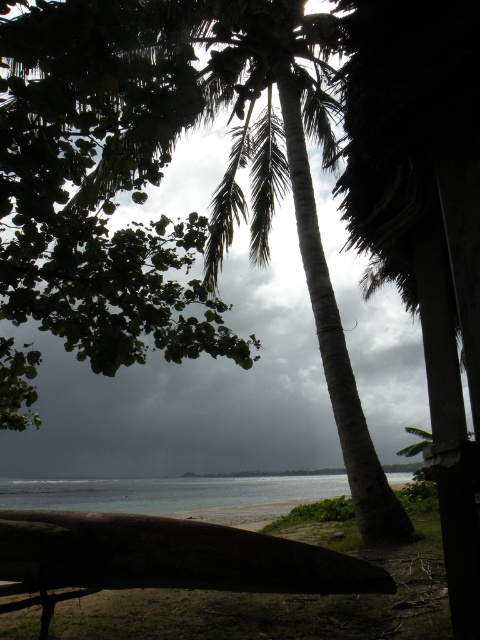
Is green textured palm tree at center to the left of clear water at lower center from the viewer's perspective?

No, green textured palm tree at center is not to the left of clear water at lower center.

Does point (288, 60) lie behind point (24, 486)?

No, it is in front of (24, 486).

At what (x,y) coordinates should I click in order to perform the action: click on green textured palm tree at center. Please return your answer as a coordinate pair (x, y). Image resolution: width=480 pixels, height=640 pixels. Looking at the image, I should click on (292, 198).